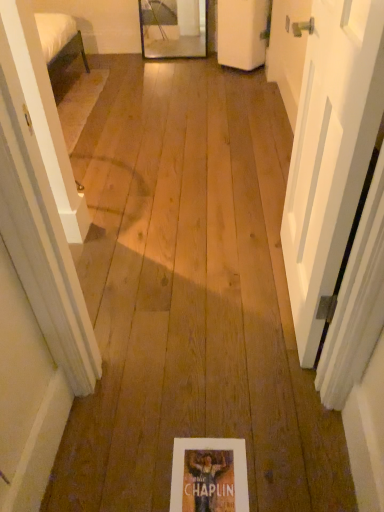
Find the location of a particular element. blank area beneath white matte door at right, placed as the second door when sorted from top to bottom (from a real-world perspective) is located at coordinates (286, 298).